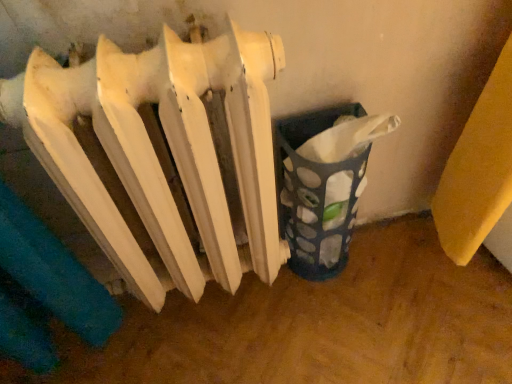
Question: Is translucent plastic basket at lower right situated inside white matte radiator at center or outside?

Choices:
 (A) inside
 (B) outside

Answer: (B)

Question: Is point (296, 142) closer or farther from the camera than point (41, 76)?

Choices:
 (A) farther
 (B) closer

Answer: (A)

Question: Looking at their shapes, would you say translucent plastic basket at lower right is wider or thinner than white matte radiator at center?

Choices:
 (A) wide
 (B) thin

Answer: (B)

Question: Relative to translucent plastic basket at lower right, is white matte radiator at center in front or behind?

Choices:
 (A) front
 (B) behind

Answer: (A)

Question: Considering the relative positions of white matte radiator at center and translucent plastic basket at lower right in the image provided, is white matte radiator at center to the left or to the right of translucent plastic basket at lower right?

Choices:
 (A) left
 (B) right

Answer: (A)

Question: From the image's perspective, is white matte radiator at center positioned above or below translucent plastic basket at lower right?

Choices:
 (A) above
 (B) below

Answer: (B)

Question: Considering the positions of point (169, 147) and point (314, 254), is point (169, 147) closer or farther from the camera than point (314, 254)?

Choices:
 (A) farther
 (B) closer

Answer: (B)